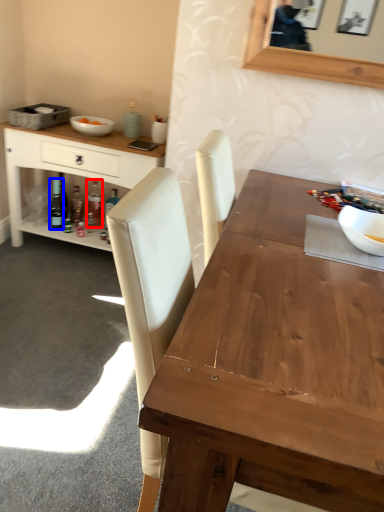
Question: Which of the following is the closest to the observer, bottle (highlighted by a red box) or bottle (highlighted by a blue box)?

Choices:
 (A) bottle
 (B) bottle

Answer: (B)